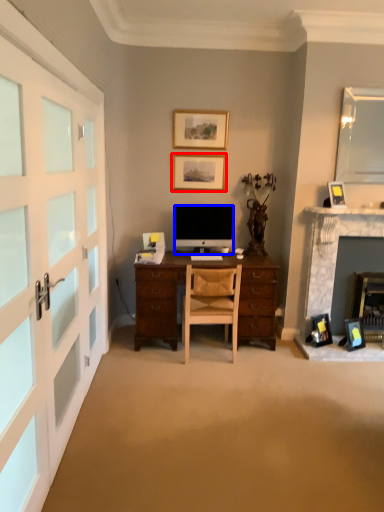
Question: Which of the following is the closest to the observer, picture frame (highlighted by a red box) or computer monitor (highlighted by a blue box)?

Choices:
 (A) picture frame
 (B) computer monitor

Answer: (B)